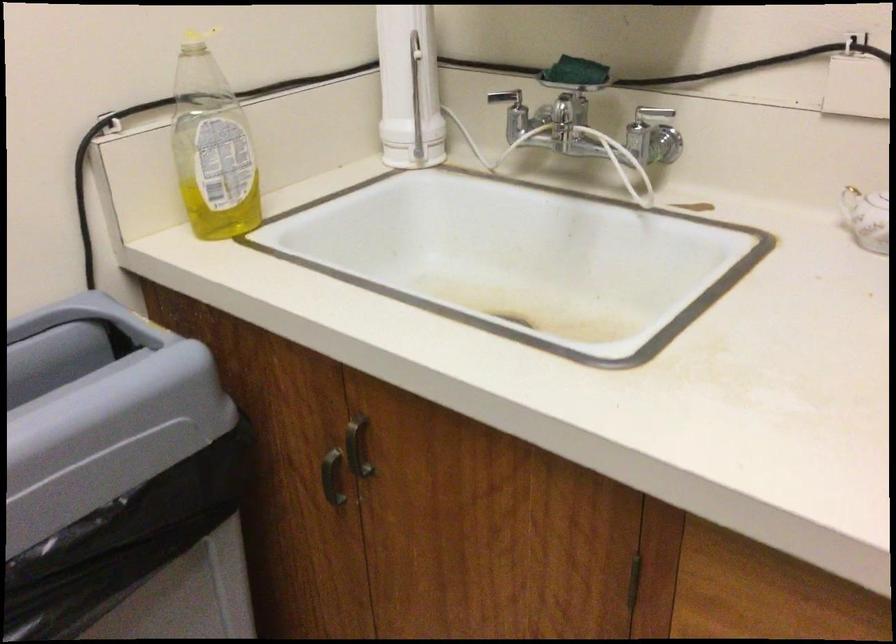
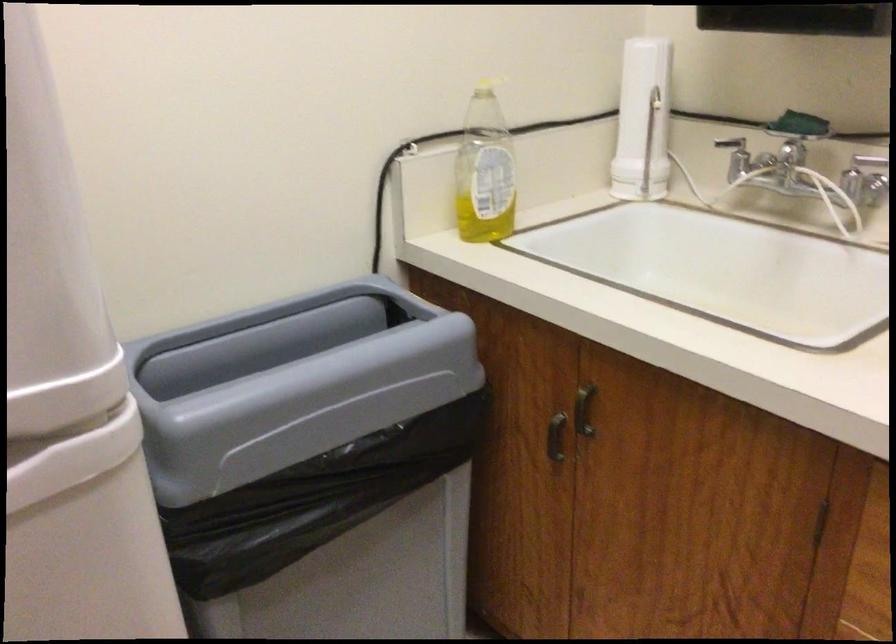
Question: The camera is either moving clockwise (left) or counter-clockwise (right) around the object. The first image is from the beginning of the video and the second image is from the end. Is the camera moving left or right when shooting the video?

Choices:
 (A) Left
 (B) Right

Answer: (B)